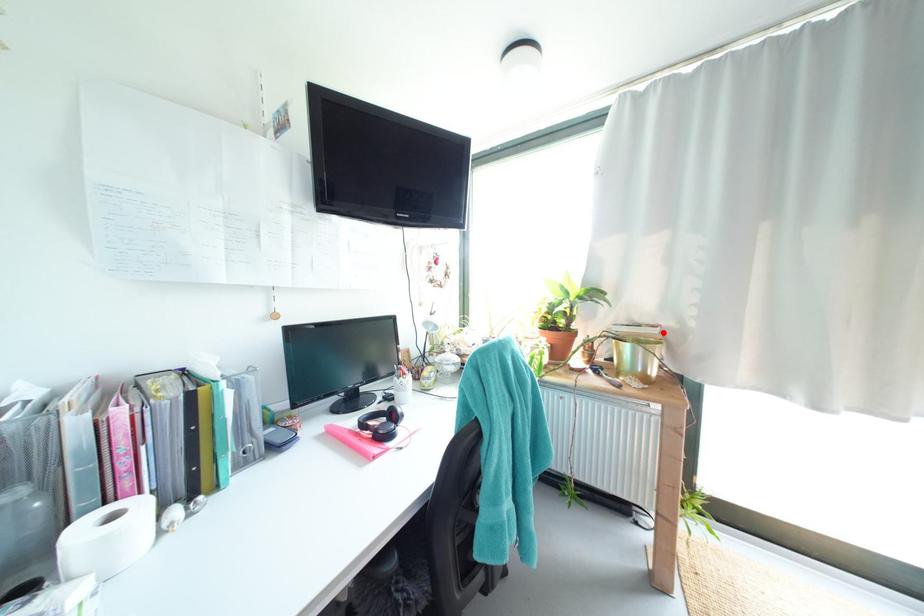
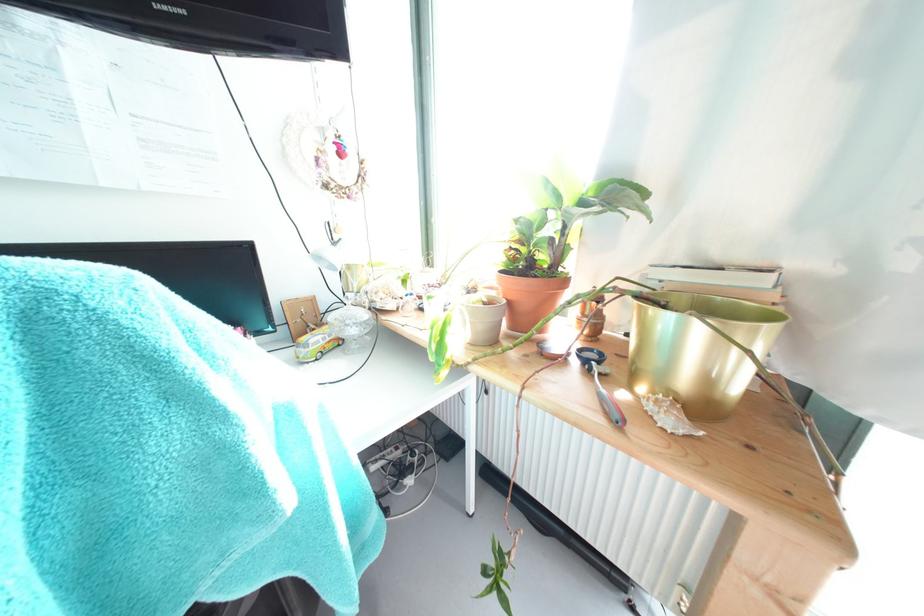
The point at the highlighted location is marked in the first image. Where is the corresponding point in the second image?

(771, 283)